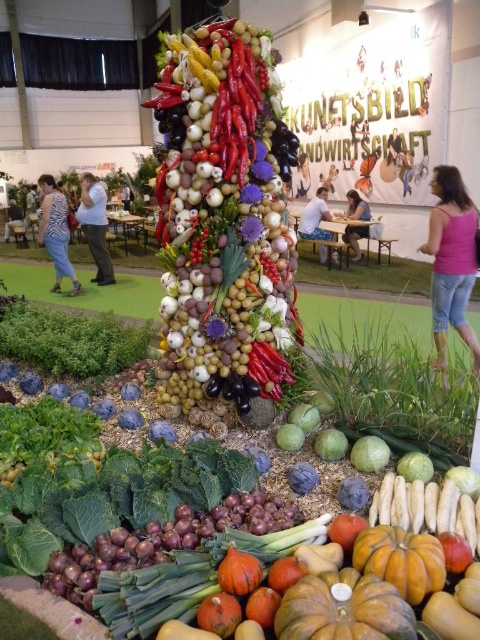
Question: Among these points, which one is nearest to the camera?

Choices:
 (A) (463, 275)
 (B) (97, 188)

Answer: (A)

Question: Which object is closer to the camera taking this photo?

Choices:
 (A) pink fabric top at right
 (B) light blue jeans at left
 (C) zebra-striped shirt at left

Answer: (A)

Question: Where is light blue jeans at left located in relation to matte black dress at center in the image?

Choices:
 (A) left
 (B) right

Answer: (A)

Question: Observing the image, what is the correct spatial positioning of shiny red pepper at center in reference to light blue denim shorts at center?

Choices:
 (A) below
 (B) above

Answer: (A)

Question: Which object is positioned farthest from the pink fabric shirt at center?

Choices:
 (A) pink fabric dress at center
 (B) matte black dress at center
 (C) matte white blouse at center

Answer: (B)

Question: Does shiny red pepper at center have a greater width compared to pink fabric shirt at center?

Choices:
 (A) no
 (B) yes

Answer: (B)